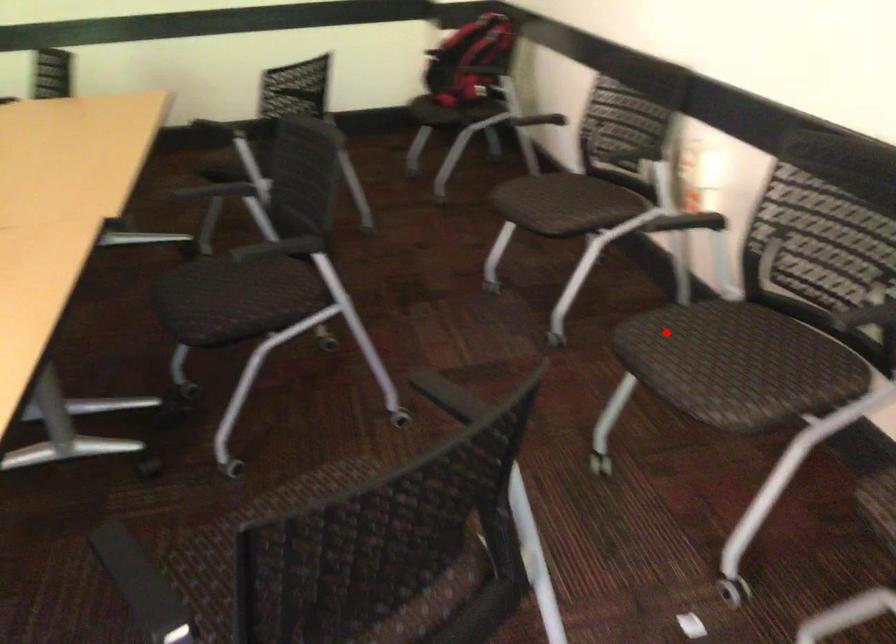
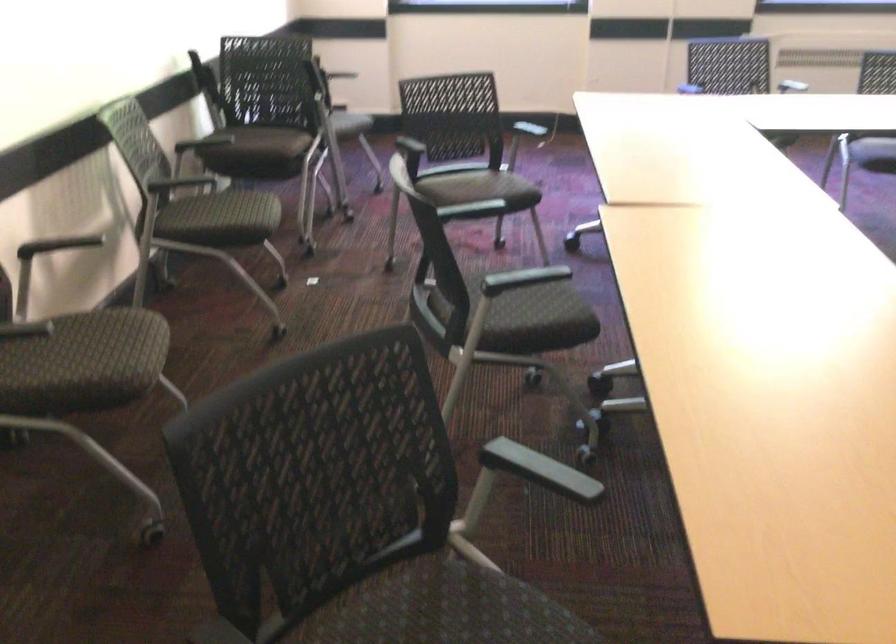
Where in the second image is the point corresponding to the highlighted location from the first image?

(250, 216)